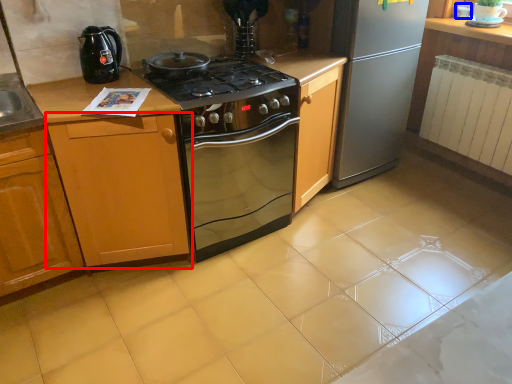
Question: Which object appears farthest to the camera in this image, cabinetry (highlighted by a red box) or appliance (highlighted by a blue box)?

Choices:
 (A) cabinetry
 (B) appliance

Answer: (B)